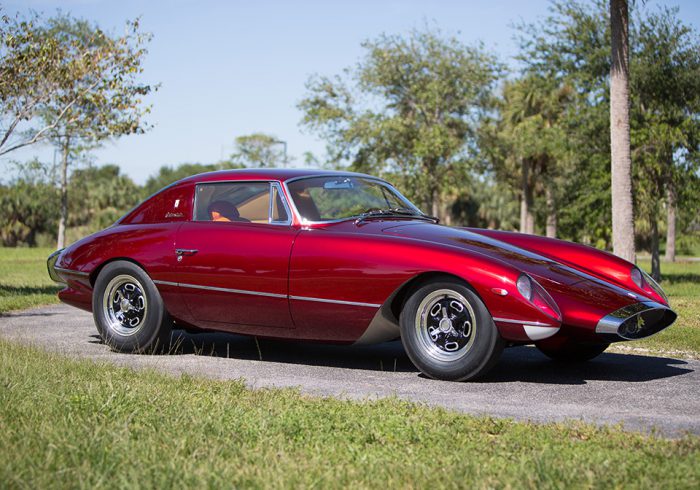
Identify the location of trim. The height and width of the screenshot is (490, 700). (295, 297).